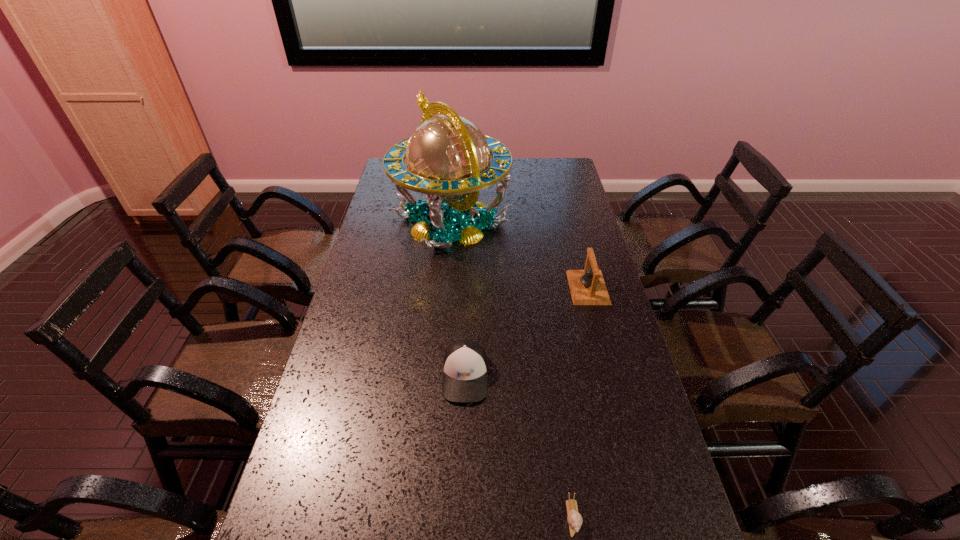
This screenshot has width=960, height=540. I want to click on the tallest object, so click(x=448, y=158).

Where is `the farthest object`? the farthest object is located at coordinates (448, 158).

You are a GUI agent. You are given a task and a screenshot of the screen. Output one action in this format:
    pyautogui.click(x=<x>, y=<y>)
    Task: Click on the bell
    
    Given the screenshot: What is the action you would take?
    pyautogui.click(x=587, y=287)

Locate an element on the screen. The width and height of the screenshot is (960, 540). the third shortest object is located at coordinates (587, 287).

Identify the location of the third farthest object. (465, 363).

The image size is (960, 540). I want to click on cap, so click(x=465, y=363).

You are a GUI agent. You are given a task and a screenshot of the screen. Output one action in this format:
    pyautogui.click(x=<x>, y=<y>)
    Task: Click on the escargot
    The image size is (960, 540).
    Given the screenshot: What is the action you would take?
    pyautogui.click(x=574, y=519)

I want to click on the shortest object, so click(574, 519).

Image resolution: width=960 pixels, height=540 pixels. What are the coordinates of `blank space located 0.130m on the front of the globe` in the screenshot? It's located at (446, 285).

The width and height of the screenshot is (960, 540). I want to click on vacant space situated on the front of the second farthest object, so click(607, 360).